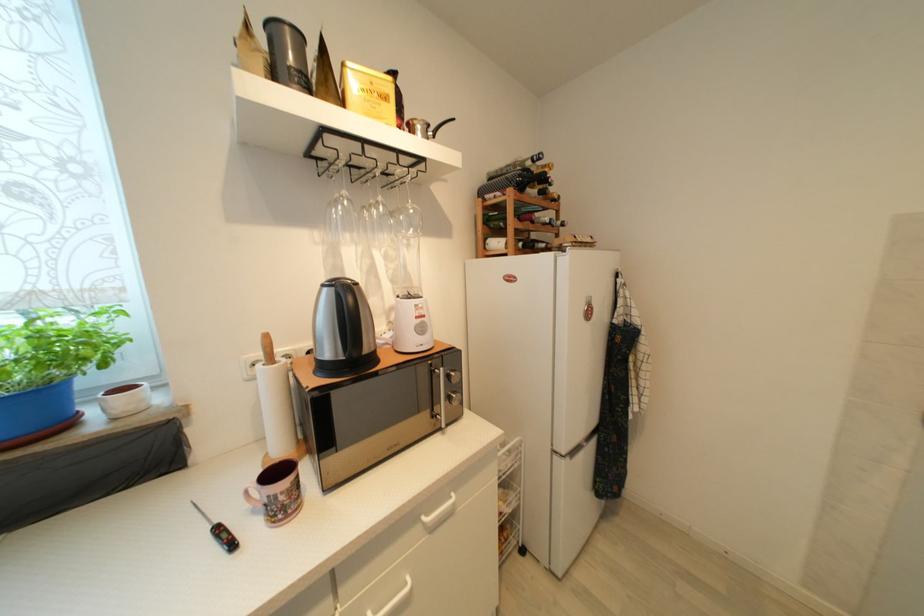
The height and width of the screenshot is (616, 924). Find the location of `kettle handle`. kettle handle is located at coordinates (426, 127).